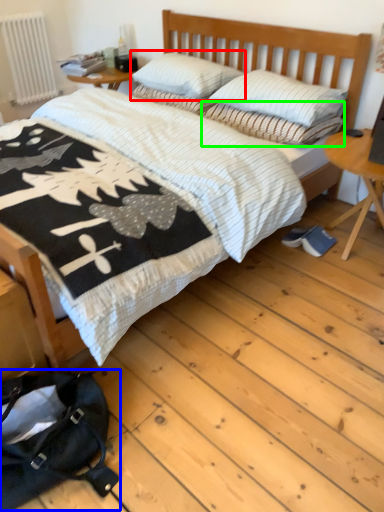
Question: Estimate the real-world distances between objects in this image. Which object is closer to pillow (highlighted by a red box), messenger bag (highlighted by a blue box) or pillow (highlighted by a green box)?

Choices:
 (A) messenger bag
 (B) pillow

Answer: (B)